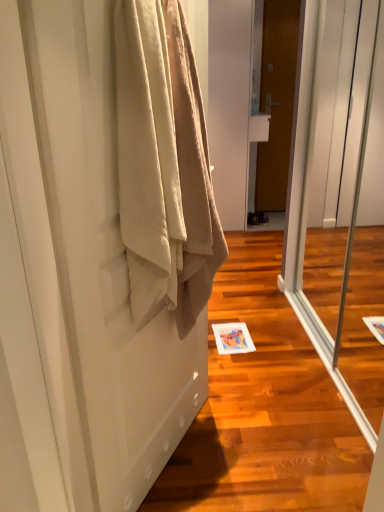
Question: Considering their positions, is brown wooden door at center, positioned as the first door in right-to-left order, located in front of or behind beige fabric door at left, which appears as the second door when viewed from the back?

Choices:
 (A) behind
 (B) front

Answer: (A)

Question: Considering the positions of brown wooden door at center, which is counted as the 1th door, starting from the top, and beige fabric door at left, which is the first door in left-to-right order, in the image, is brown wooden door at center, which is counted as the 1th door, starting from the top, taller or shorter than beige fabric door at left, which is the first door in left-to-right order,?

Choices:
 (A) short
 (B) tall

Answer: (B)

Question: Considering the real-world distances, which object is closest to the beige fabric door at left, which is the first door in left-to-right order?

Choices:
 (A) transparent glass screen door at center
 (B) brown wooden door at center, which ranks as the second door in front-to-back order
 (C) beige textured towel at left

Answer: (C)

Question: Estimate the real-world distances between objects in this image. Which object is farther from the beige textured towel at left?

Choices:
 (A) beige fabric door at left, placed as the second door when sorted from right to left
 (B) transparent glass screen door at center
 (C) brown wooden door at center, which ranks as the second door in front-to-back order

Answer: (C)